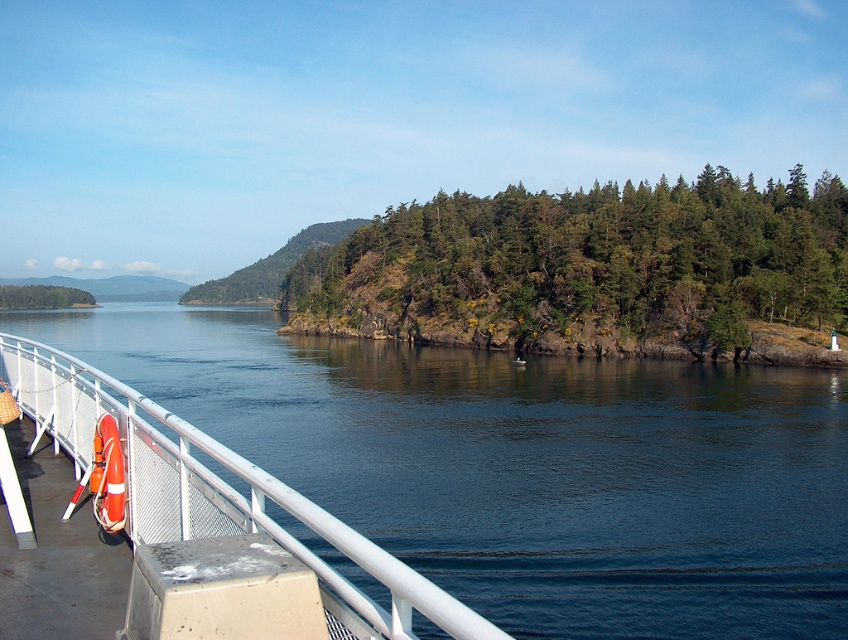
Is green rough textured trees at center bigger than white metal/rail at left?

Correct, green rough textured trees at center is larger in size than white metal/rail at left.

Can you confirm if green rough textured trees at center is positioned to the right of white metal/rail at left?

Correct, you'll find green rough textured trees at center to the right of white metal/rail at left.

Is point (657, 339) behind point (138, 509)?

That is True.

Identify the location of green rough textured trees at center. (595, 272).

Is white metal/rail at left above green matte tree at left?

No, white metal/rail at left is not above green matte tree at left.

Between white metal/rail at left and green matte tree at left, which one has more height?

With more height is green matte tree at left.

Who is more distant from viewer, (x=377, y=545) or (x=17, y=301)?

Point (x=17, y=301)

Find the location of `white metal/rail at left`. white metal/rail at left is located at coordinates (218, 492).

Is green rough textured trees at center positioned in front of orange rubber life jacket at lower left?

No, green rough textured trees at center is behind orange rubber life jacket at lower left.

Does green rough textured trees at center have a lesser width compared to orange rubber life jacket at lower left?

In fact, green rough textured trees at center might be wider than orange rubber life jacket at lower left.

Is point (519, 342) farther from viewer compared to point (112, 499)?

That is True.

Identify the location of green rough textured trees at center. This screenshot has height=640, width=848. (595, 272).